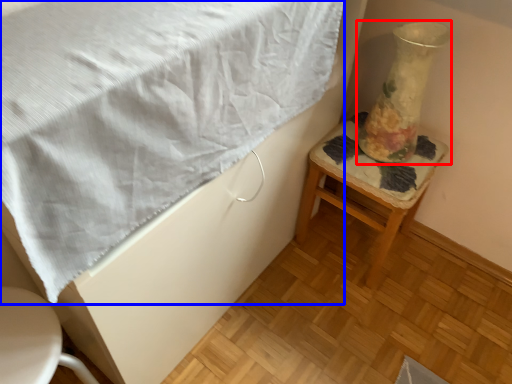
Question: Among these objects, which one is nearest to the camera, vase (highlighted by a red box) or blanket (highlighted by a blue box)?

Choices:
 (A) vase
 (B) blanket

Answer: (B)